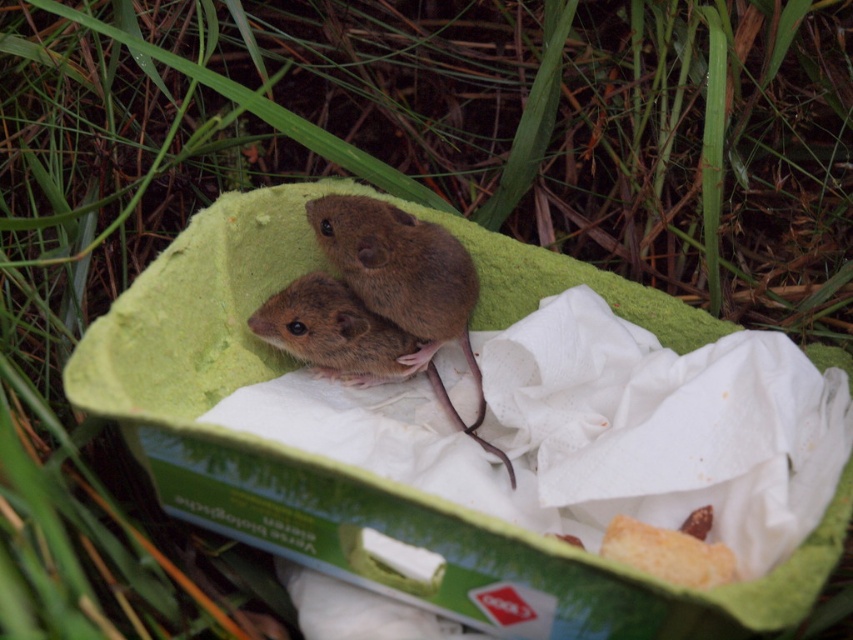
You are observing two mice in a container. Based on their positions, which mouse is closer to you? The mouse at point [309,216] or the mouse at point [345,330]?

The mouse at point [309,216] is closer to you since it is in front of the mouse at point [345,330].

You are a researcher studying animal behavior. You need to place a food dispenser at a specific coordinate to observe the hamster. What coordinate should you place it at to ensure it is directly in front of the brown furry hamster at center?

The brown furry hamster at center is located at coordinate point (405,284). To place the food dispenser directly in front of it, you should position it at the same x coordinate, 0.444, but adjust the y coordinate to a value slightly lower than 0.477 to ensure it is in front. However, since the exact distance isn

You are a veterinarian examining two small animals in a green plastic container. You notice both a brown furry hamster at center and a brown furry mouse at center. Which of these two animals is taller?

The brown furry hamster at center is taller than the brown furry mouse at center according to the description provided.